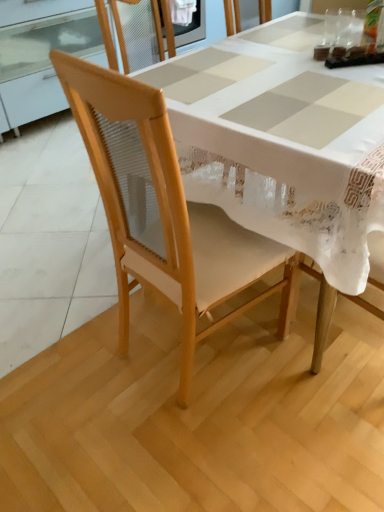
Question: Looking at their shapes, would you say natural wood chair at center is wider or thinner than transparent glass at upper center, which ranks as the second tableware in left-to-right order?

Choices:
 (A) thin
 (B) wide

Answer: (B)

Question: Considering the positions of natural wood chair at center and transparent glass at upper center, which ranks as the second tableware in left-to-right order, in the image, is natural wood chair at center taller or shorter than transparent glass at upper center, which ranks as the second tableware in left-to-right order,?

Choices:
 (A) short
 (B) tall

Answer: (B)

Question: Estimate the real-world distances between objects in this image. Which object is closer to the natural wood chair at center?

Choices:
 (A) transparent plastic cup at upper right, placed as the first tableware when sorted from left to right
 (B) transparent glass at upper center, which ranks as the second tableware in left-to-right order
 (C) white fabric table at center

Answer: (C)

Question: Considering the real-world distances, which object is closest to the natural wood chair at center?

Choices:
 (A) transparent plastic cup at upper right, placed as the first tableware when sorted from left to right
 (B) white fabric table at center
 (C) transparent glass at upper center, placed as the first tableware when sorted from right to left

Answer: (B)